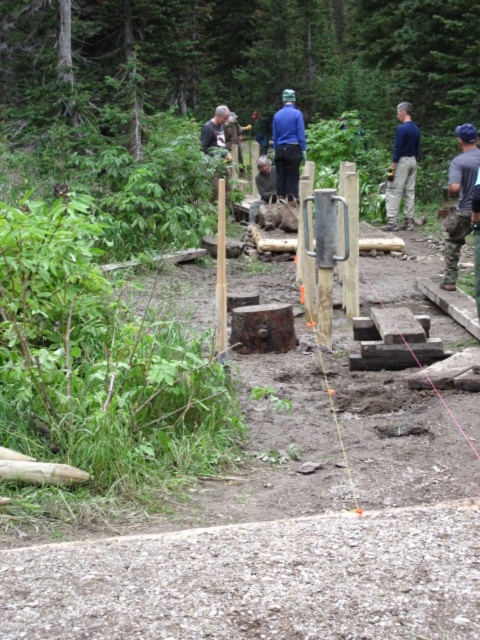
Question: Considering the real-world distances, which object is farthest from the wooden post at center?

Choices:
 (A) camouflage pants at right
 (B) gravelly dirt trail at lower center
 (C) blue fabric construction worker at right

Answer: (C)

Question: Is camouflage pants at right below blue fabric construction worker at right?

Choices:
 (A) yes
 (B) no

Answer: (A)

Question: Which of the following is the closest to the observer?

Choices:
 (A) (398, 186)
 (B) (420, 634)

Answer: (B)

Question: Does blue fabric construction worker at right come behind dark brown leather jacket at upper center?

Choices:
 (A) yes
 (B) no

Answer: (B)

Question: Considering the relative positions of blue fabric construction worker at right and wooden post at center in the image provided, where is blue fabric construction worker at right located with respect to wooden post at center?

Choices:
 (A) right
 (B) left

Answer: (A)

Question: Which of these objects is positioned closest to the blue fabric construction worker at right?

Choices:
 (A) dark brown leather jacket at upper center
 (B) gravelly dirt trail at lower center
 (C) wooden post at center
 (D) camouflage pants at right

Answer: (A)